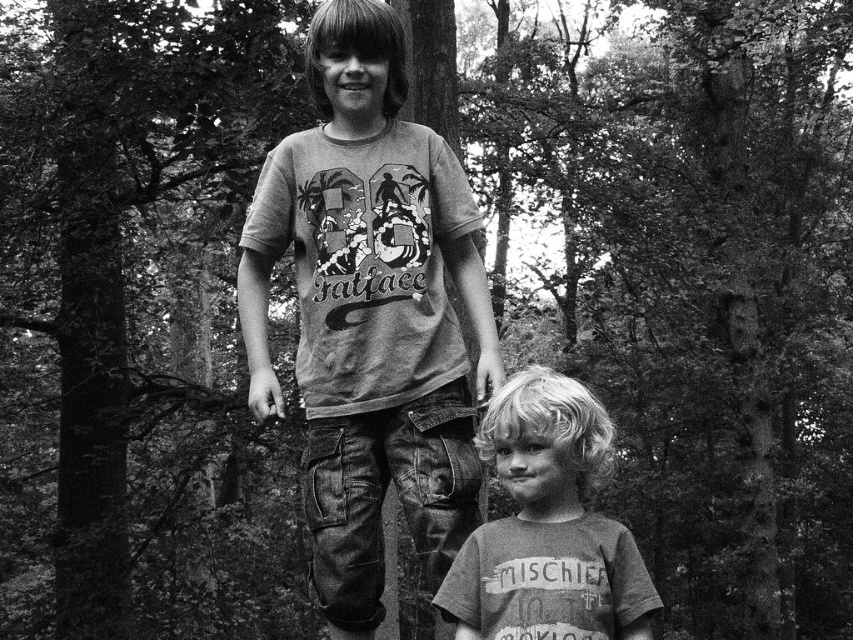
Question: Among these points, which one is nearest to the camera?

Choices:
 (A) (378, 88)
 (B) (572, 394)

Answer: (B)

Question: Among these points, which one is farthest from the camera?

Choices:
 (A) (474, 586)
 (B) (447, 154)

Answer: (B)

Question: Does matte gray t-shirt at center appear under matte gray t-shirt at lower center?

Choices:
 (A) yes
 (B) no

Answer: (B)

Question: Which point is farther to the camera?

Choices:
 (A) matte gray t-shirt at center
 (B) matte gray t-shirt at lower center

Answer: (A)

Question: Is matte gray t-shirt at center smaller than matte gray t-shirt at lower center?

Choices:
 (A) yes
 (B) no

Answer: (B)

Question: Is matte gray t-shirt at center thinner than matte gray t-shirt at lower center?

Choices:
 (A) no
 (B) yes

Answer: (A)